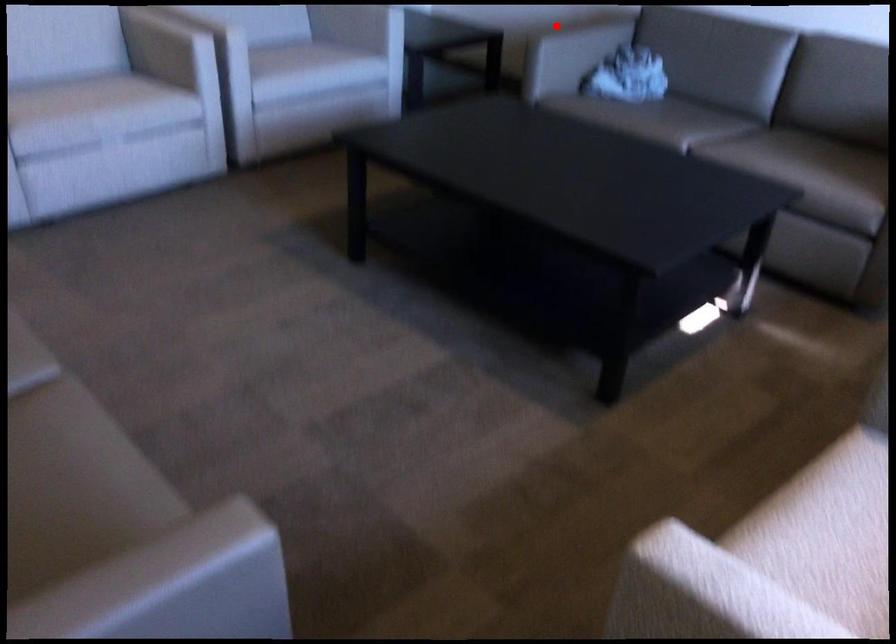
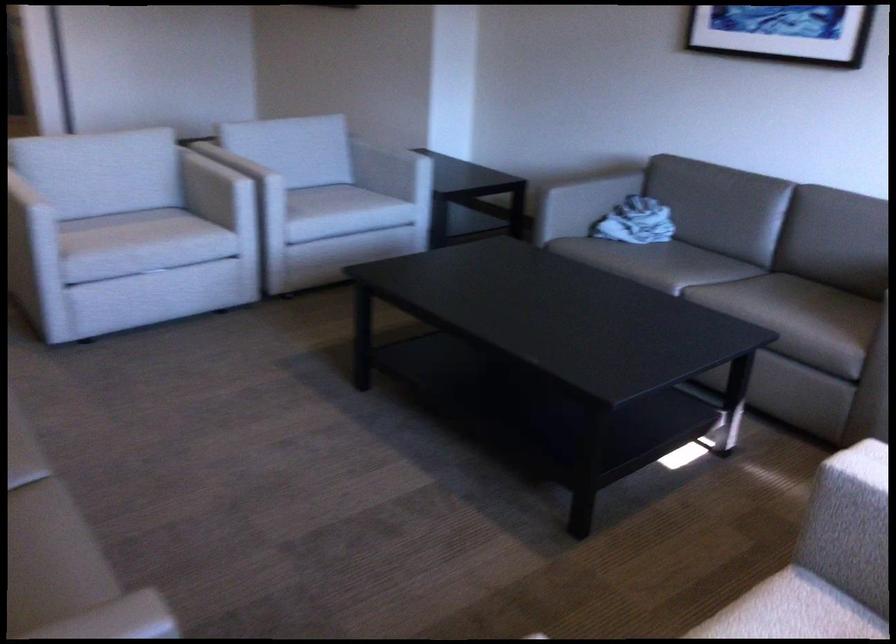
Question: I am providing you with two images of the same scene from different viewpoints. A red point is marked on the first image. Is the red point's position out of view in image 2?

Choices:
 (A) Yes
 (B) No

Answer: (A)